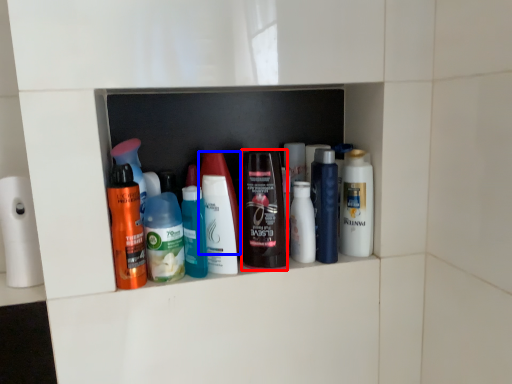
Question: Among these objects, which one is farthest to the camera, toiletry (highlighted by a red box) or toiletry (highlighted by a blue box)?

Choices:
 (A) toiletry
 (B) toiletry

Answer: (A)